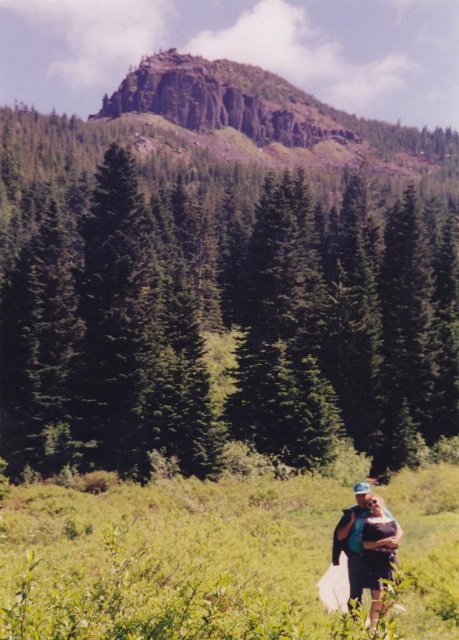
Consider the image. You are standing in the middle of the green grassy field at lower center and want to reach the base of the green matte tree at center. Which direction should you walk to get closer to the tree?

You should walk towards the center of the scene because the green matte tree at center is located in the central area, which is farther away from the green grassy field at lower center.

You are planning to set up a picnic in this serene landscape. You have a large blanket that can cover an area equivalent to the size of the green grassy field at lower center. If you want to place the blanket under the green matte tree at center, will there be enough space for the blanket to fit entirely under the tree?

The green matte tree at center is larger in size than the green grassy field at lower center. Since the blanket is the size of the green grassy field at lower center, it should fit entirely under the green matte tree at center as the tree is bigger.

You are standing at the camera position looking at the landscape. There is a specific point marked at coordinates point (179,228). Can you estimate how far this point is from your current position?

The point (179,228) is 94.98 meters away from the camera position.